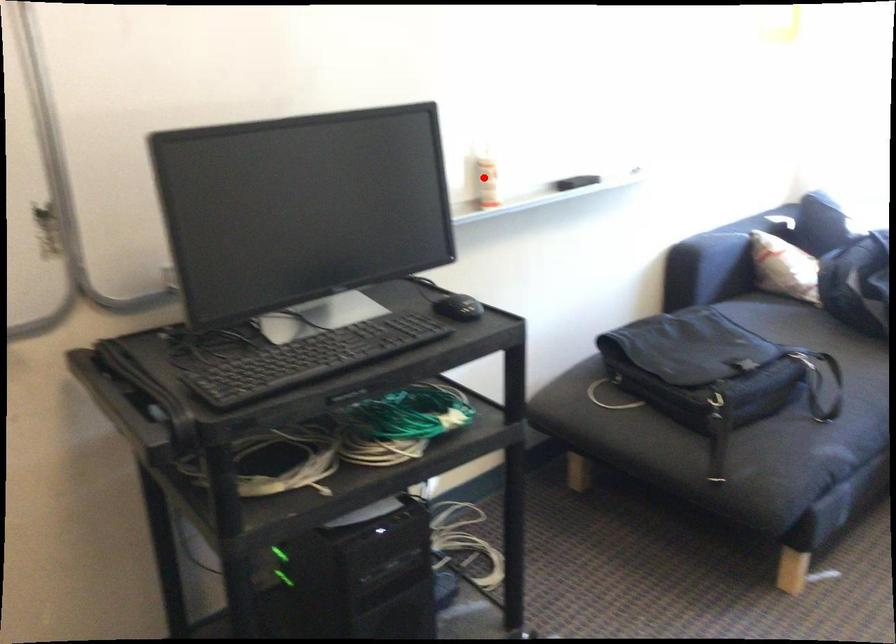
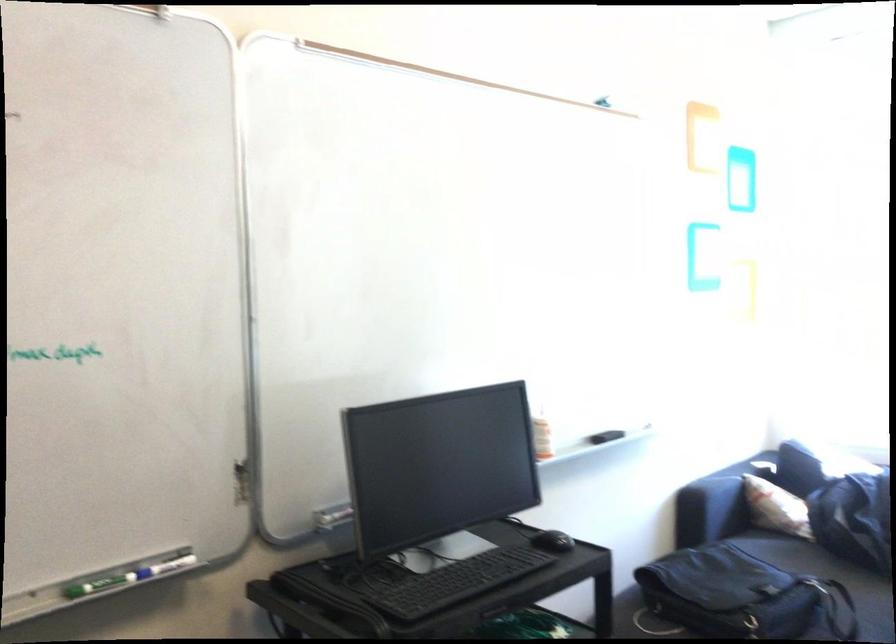
The point at the highlighted location is marked in the first image. Where is the corresponding point in the second image?

(540, 431)